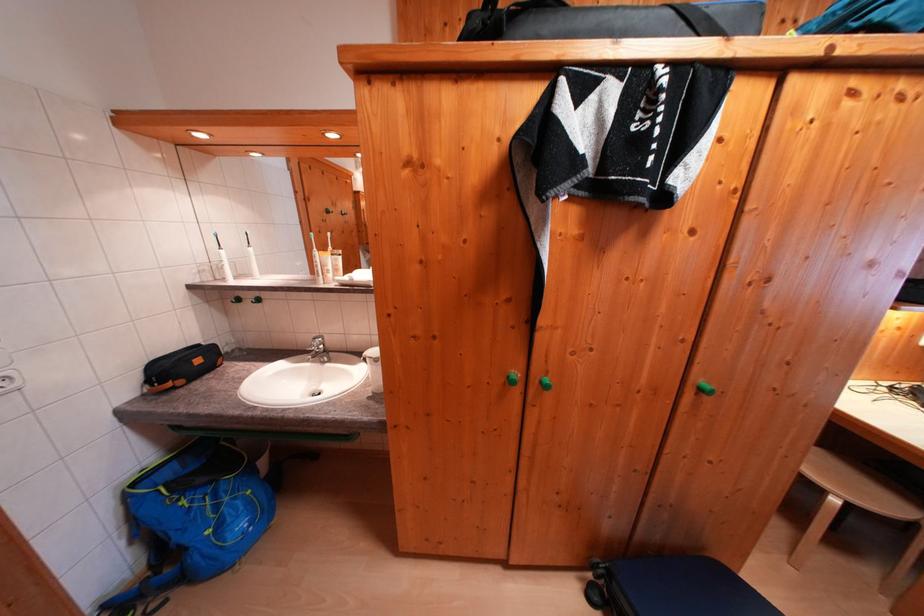
The location [193,517] corresponds to which object?

It corresponds to the black toiletry bag in the image.